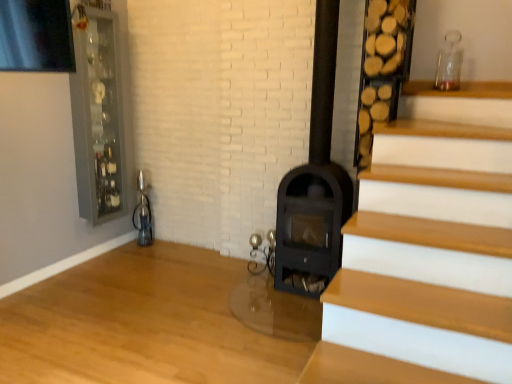
This screenshot has width=512, height=384. Describe the element at coordinates (314, 183) in the screenshot. I see `black matte fireplace at center` at that location.

Locate an element on the screen. black matte fireplace at center is located at coordinates (314, 183).

What do you see at coordinates (98, 116) in the screenshot? Image resolution: width=512 pixels, height=384 pixels. I see `clear glass cabinet at upper left` at bounding box center [98, 116].

At what (x,y) coordinates should I click in order to perform the action: click on clear glass cabinet at upper left. Please return your answer as a coordinate pair (x, y). This screenshot has height=384, width=512. Looking at the image, I should click on (98, 116).

I want to click on black matte fireplace at center, so click(314, 183).

In the scene shown: Considering the relative positions of black matte fireplace at center and clear glass cabinet at upper left in the image provided, is black matte fireplace at center to the right of clear glass cabinet at upper left from the viewer's perspective?

Yes.

Is the position of black matte fireplace at center more distant than that of clear glass cabinet at upper left?

That is False.

Between point (335, 33) and point (94, 189), which one is positioned behind?

The point (94, 189) is more distant.

From the image's perspective, would you say black matte fireplace at center is positioned over clear glass cabinet at upper left?

Incorrect, from the image's perspective, black matte fireplace at center is lower than clear glass cabinet at upper left.

From a real-world perspective, who is located lower, black matte fireplace at center or clear glass cabinet at upper left?

black matte fireplace at center is physically lower.

Is black matte fireplace at center wider or thinner than clear glass cabinet at upper left?

Clearly, black matte fireplace at center has more width compared to clear glass cabinet at upper left.

Considering the sizes of objects black matte fireplace at center and clear glass cabinet at upper left in the image provided, who is taller, black matte fireplace at center or clear glass cabinet at upper left?

With more height is black matte fireplace at center.

Considering the sizes of objects black matte fireplace at center and clear glass cabinet at upper left in the image provided, who is bigger, black matte fireplace at center or clear glass cabinet at upper left?

black matte fireplace at center.

Is black matte fireplace at center inside or outside of clear glass cabinet at upper left?

black matte fireplace at center cannot be found inside clear glass cabinet at upper left.

Would you consider black matte fireplace at center to be distant from clear glass cabinet at upper left?

black matte fireplace at center is far away from clear glass cabinet at upper left.

Consider the image. Does black matte fireplace at center turn towards clear glass cabinet at upper left?

No.

Where is `fireplace lying in front of the clear glass cabinet at upper left`? This screenshot has height=384, width=512. fireplace lying in front of the clear glass cabinet at upper left is located at coordinates (314, 183).

Can you confirm if clear glass cabinet at upper left is positioned to the left of black matte fireplace at center?

Yes.

Which object is closer to the camera taking this photo, clear glass cabinet at upper left or black matte fireplace at center?

black matte fireplace at center is more forward.

Does point (78, 163) come in front of point (348, 183)?

No, (78, 163) is further to viewer.

From the image's perspective, which one is positioned lower, clear glass cabinet at upper left or black matte fireplace at center?

black matte fireplace at center appears lower in the image.

Looking at this image, from a real-world perspective, which object rests below the other?

From a 3D spatial view, black matte fireplace at center is below.

Considering the relative sizes of clear glass cabinet at upper left and black matte fireplace at center in the image provided, is clear glass cabinet at upper left thinner than black matte fireplace at center?

Yes.

Considering the sizes of clear glass cabinet at upper left and black matte fireplace at center in the image, is clear glass cabinet at upper left taller or shorter than black matte fireplace at center?

Clearly, clear glass cabinet at upper left is shorter compared to black matte fireplace at center.

Does clear glass cabinet at upper left have a smaller size compared to black matte fireplace at center?

Indeed, clear glass cabinet at upper left has a smaller size compared to black matte fireplace at center.

Would you say clear glass cabinet at upper left contains black matte fireplace at center?

Definitely not — black matte fireplace at center is not inside clear glass cabinet at upper left.

Is there a large distance between clear glass cabinet at upper left and black matte fireplace at center?

Yes, clear glass cabinet at upper left is far from black matte fireplace at center.

Is clear glass cabinet at upper left turned away from black matte fireplace at center?

No, clear glass cabinet at upper left's orientation is not away from black matte fireplace at center.

How different are the orientations of clear glass cabinet at upper left and black matte fireplace at center in degrees?

There is a 89.3-degree angle between the facing directions of clear glass cabinet at upper left and black matte fireplace at center.

The height and width of the screenshot is (384, 512). What are the coordinates of `fireplace below the clear glass cabinet at upper left (from a real-world perspective)` in the screenshot? It's located at (314, 183).

Find the location of a particular element. fireplace in front of the clear glass cabinet at upper left is located at coordinates (314, 183).

Where is `fireplace beneath the clear glass cabinet at upper left (from a real-world perspective)`? The height and width of the screenshot is (384, 512). fireplace beneath the clear glass cabinet at upper left (from a real-world perspective) is located at coordinates (314, 183).